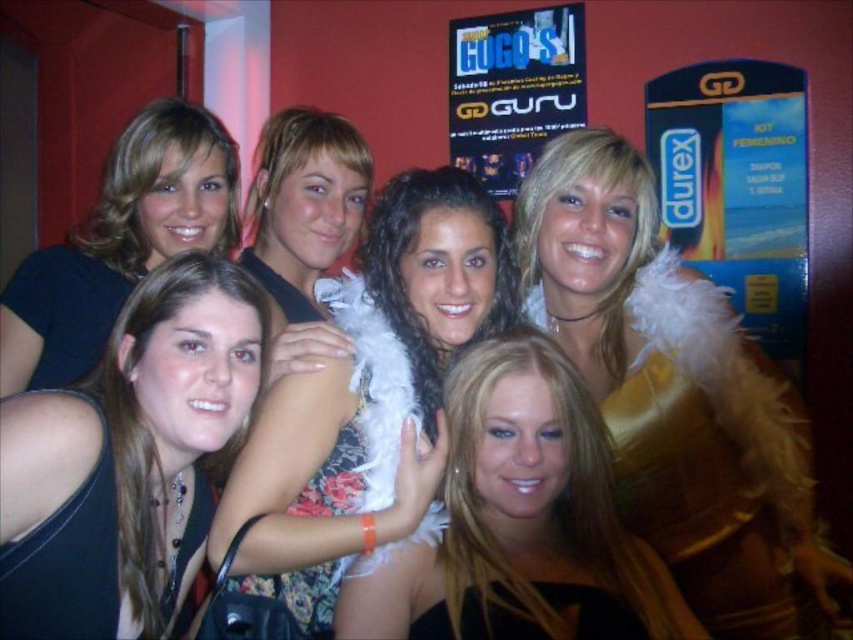
Which is below, shiny black dress at center or matte black shirt at upper left?

shiny black dress at center is lower down.

Does shiny black dress at center lie in front of matte black shirt at upper left?

Yes, it is in front of matte black shirt at upper left.

Which is in front, point (480, 372) or point (158, 257)?

Point (480, 372)

At what (x,y) coordinates should I click in order to perform the action: click on shiny black dress at center. Please return your answer as a coordinate pair (x, y). The height and width of the screenshot is (640, 853). Looking at the image, I should click on (520, 520).

Find the location of a particular element. This screenshot has width=853, height=640. gold shiny feather boa at upper center is located at coordinates (674, 392).

From the picture: Who is lower down, gold shiny feather boa at upper center or black fabric dress at center?

black fabric dress at center is lower down.

Between point (660, 556) and point (100, 592), which one is positioned in front?

Positioned in front is point (100, 592).

You are a GUI agent. You are given a task and a screenshot of the screen. Output one action in this format:
    pyautogui.click(x=<x>, y=<y>)
    Task: Click on the gold shiny feather boa at upper center
    This screenshot has height=640, width=853.
    Given the screenshot: What is the action you would take?
    pyautogui.click(x=674, y=392)

Does point (550, 506) come closer to viewer compared to point (144, 605)?

No, (550, 506) is behind (144, 605).

Which is above, shiny black dress at center or black fabric dress at center?

Positioned higher is black fabric dress at center.

Does point (520, 512) come behind point (51, 515)?

Yes, it is behind point (51, 515).

The width and height of the screenshot is (853, 640). Find the location of `shiny black dress at center`. shiny black dress at center is located at coordinates (520, 520).